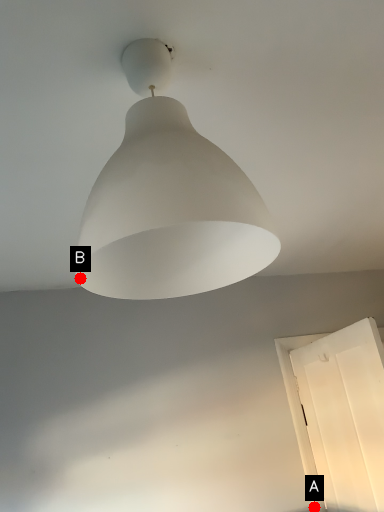
Question: Two points are circled on the image, labeled by A and B beside each circle. Which point is closer to the camera?

Choices:
 (A) A is closer
 (B) B is closer

Answer: (B)